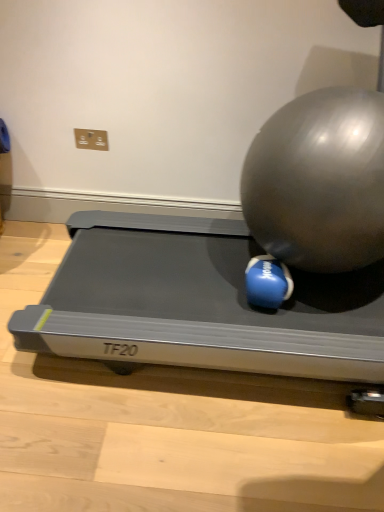
Question: Is silver metallic treadmill at center oriented away from blue rubber ball at center, positioned as the second ball in right-to-left order?

Choices:
 (A) yes
 (B) no

Answer: (B)

Question: Does silver metallic treadmill at center have a larger size compared to blue rubber ball at center, positioned as the second ball in right-to-left order?

Choices:
 (A) no
 (B) yes

Answer: (B)

Question: Would you say silver metallic treadmill at center is a long distance from blue rubber ball at center, positioned as the second ball in right-to-left order?

Choices:
 (A) yes
 (B) no

Answer: (B)

Question: Is the position of silver metallic treadmill at center more distant than that of blue rubber ball at center, positioned as the second ball in right-to-left order?

Choices:
 (A) yes
 (B) no

Answer: (B)

Question: Can you confirm if silver metallic treadmill at center is smaller than blue rubber ball at center, positioned as the second ball in right-to-left order?

Choices:
 (A) yes
 (B) no

Answer: (B)

Question: From a real-world perspective, relative to shiny metallic ball at center right, arranged as the second ball when viewed from the left, is silver metallic treadmill at center vertically above or below?

Choices:
 (A) below
 (B) above

Answer: (A)

Question: Is point click(x=119, y=353) positioned closer to the camera than point click(x=292, y=130)?

Choices:
 (A) closer
 (B) farther

Answer: (B)

Question: Looking at the image, does silver metallic treadmill at center seem bigger or smaller compared to shiny metallic ball at center right, which is counted as the 1th ball, starting from the right?

Choices:
 (A) small
 (B) big

Answer: (A)

Question: In terms of width, does silver metallic treadmill at center look wider or thinner when compared to shiny metallic ball at center right, which is counted as the 1th ball, starting from the right?

Choices:
 (A) thin
 (B) wide

Answer: (B)

Question: Is point (94, 212) closer or farther from the camera than point (289, 287)?

Choices:
 (A) closer
 (B) farther

Answer: (B)

Question: Is silver metallic treadmill at center taller or shorter than blue rubber ball at center, marked as the 1th ball in a left-to-right arrangement?

Choices:
 (A) tall
 (B) short

Answer: (B)

Question: Is silver metallic treadmill at center wider or thinner than blue rubber ball at center, positioned as the second ball in right-to-left order?

Choices:
 (A) thin
 (B) wide

Answer: (B)

Question: Visually, is silver metallic treadmill at center positioned to the left or to the right of blue rubber ball at center, marked as the 1th ball in a left-to-right arrangement?

Choices:
 (A) left
 (B) right

Answer: (A)

Question: In terms of width, does shiny metallic ball at center right, which is counted as the 1th ball, starting from the right, look wider or thinner when compared to blue rubber ball at center, marked as the 1th ball in a left-to-right arrangement?

Choices:
 (A) wide
 (B) thin

Answer: (A)

Question: In the image, is shiny metallic ball at center right, arranged as the second ball when viewed from the left, on the left side or the right side of blue rubber ball at center, positioned as the second ball in right-to-left order?

Choices:
 (A) left
 (B) right

Answer: (B)